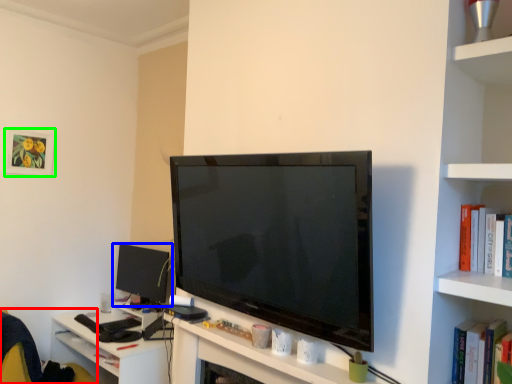
Question: Which object is positioned closest to swivel chair (highlighted by a red box)? Select from computer monitor (highlighted by a blue box) and picture frame (highlighted by a green box).

Choices:
 (A) computer monitor
 (B) picture frame

Answer: (A)